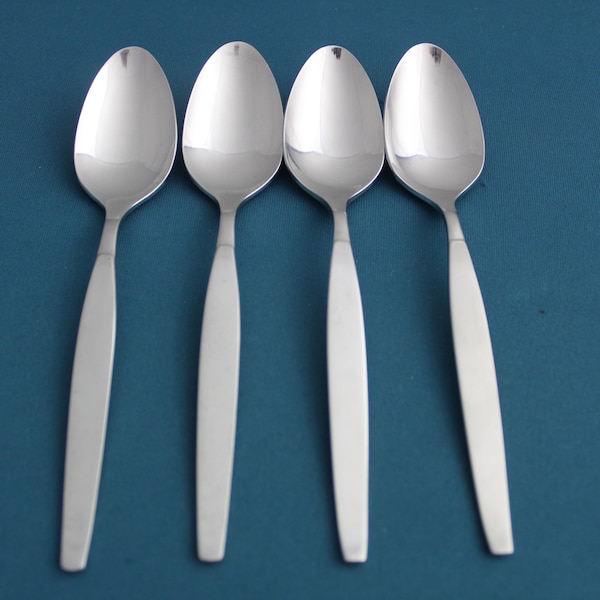
Locate an element on the screen. The width and height of the screenshot is (600, 600). spoon handle is located at coordinates (89, 355), (201, 367), (337, 373), (463, 366).